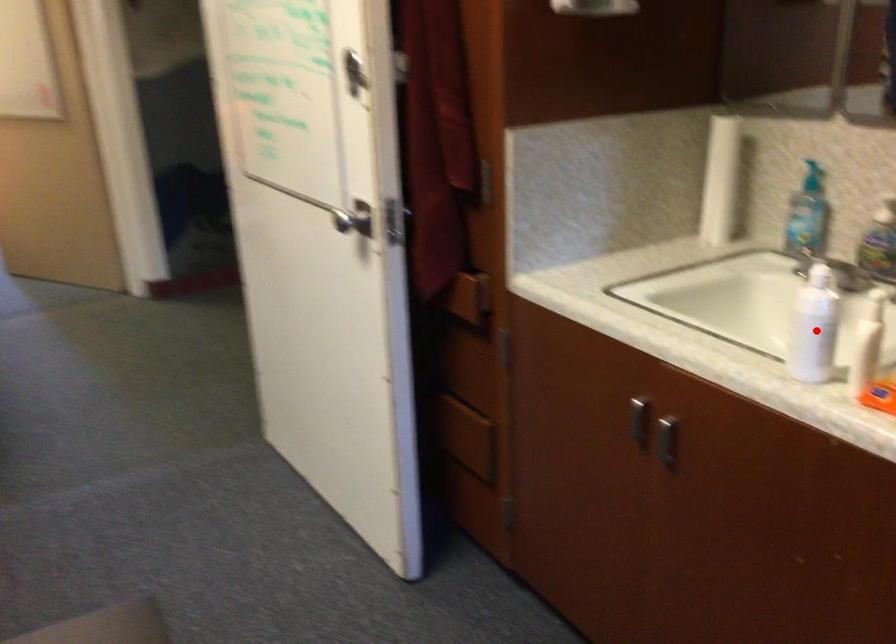
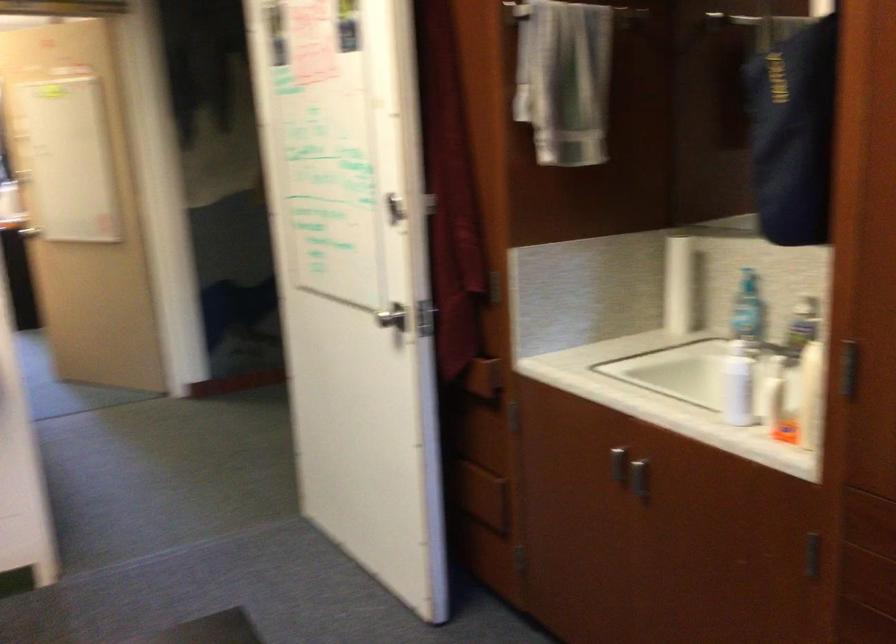
Question: I am providing you with two images of the same scene from different viewpoints. Image1 has a red point marked. In image2, the corresponding 3D location appears at what relative position? Reply with the corresponding letter.

Choices:
 (A) Closer
 (B) Farther

Answer: (B)